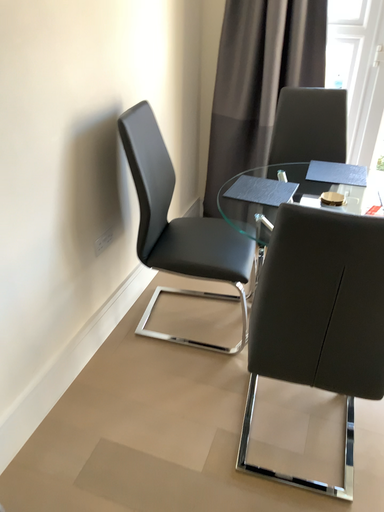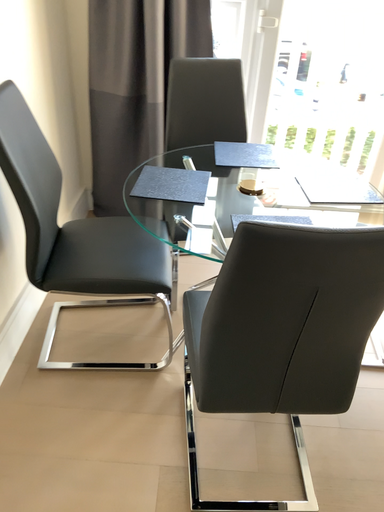
Question: How did the camera likely rotate when shooting the video?

Choices:
 (A) rotated right
 (B) rotated left

Answer: (A)